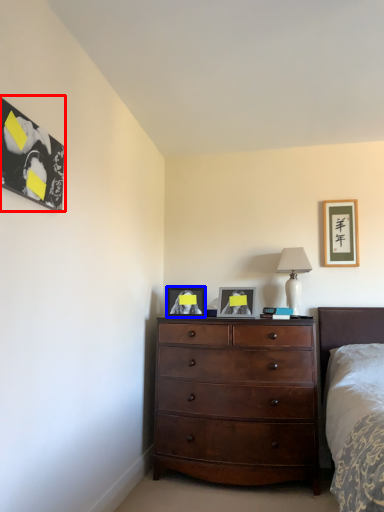
Question: Which object is closer to the camera taking this photo, picture frame (highlighted by a red box) or picture frame (highlighted by a blue box)?

Choices:
 (A) picture frame
 (B) picture frame

Answer: (A)